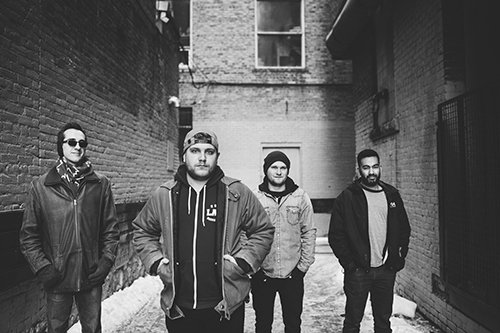
Locate an element on the screen. This screenshot has width=500, height=333. windows is located at coordinates (279, 42), (182, 117), (182, 31).